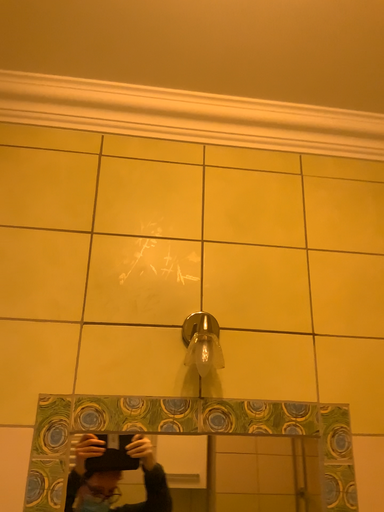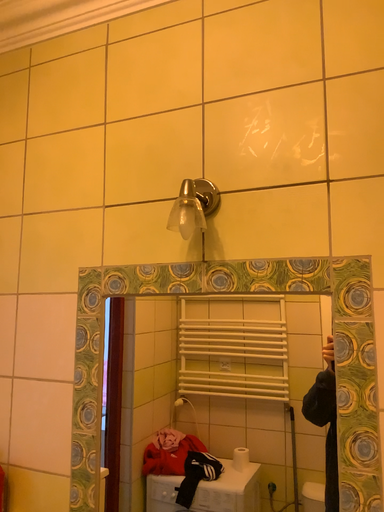
Question: Which way did the camera rotate in the video?

Choices:
 (A) rotated upward
 (B) rotated downward

Answer: (B)